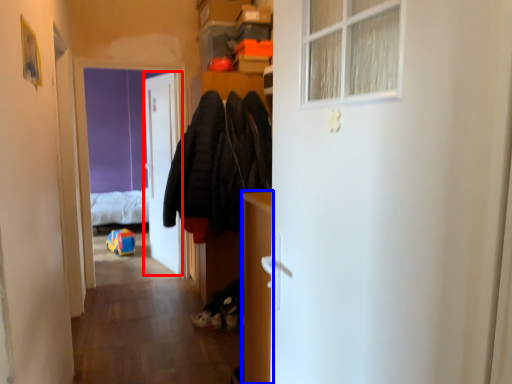
Question: Among these objects, which one is farthest to the camera, door (highlighted by a red box) or cabinetry (highlighted by a blue box)?

Choices:
 (A) door
 (B) cabinetry

Answer: (A)